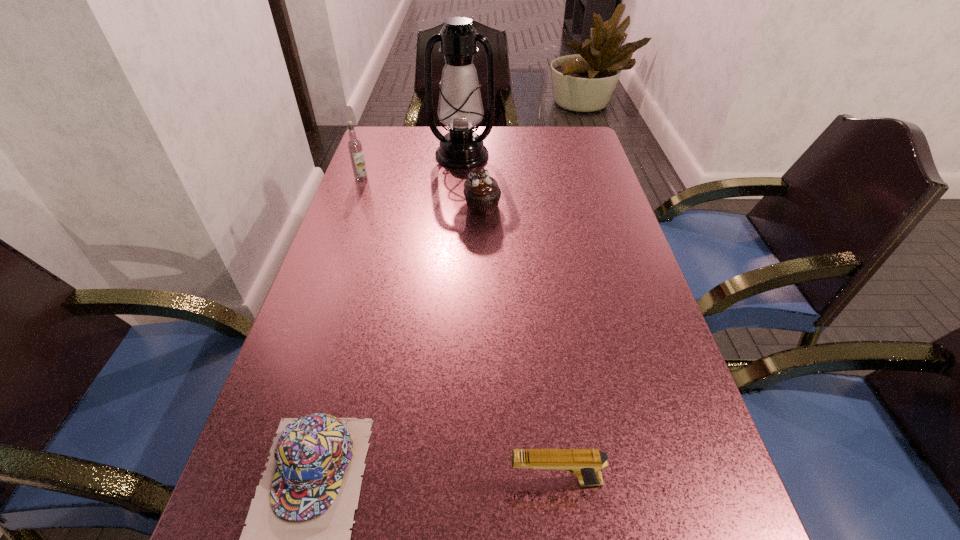
Identify the location of empty space between the fourth shortest object and the pistol. The image size is (960, 540). (458, 330).

Locate an element on the screen. The width and height of the screenshot is (960, 540). free space that is in between the tallest object and the vodka is located at coordinates (412, 167).

This screenshot has height=540, width=960. In order to click on vacant space in between the third nearest object and the pistol in this screenshot , I will do `click(518, 344)`.

Where is `vacant area that lies between the second farthest object and the oil lamp`? The image size is (960, 540). vacant area that lies between the second farthest object and the oil lamp is located at coordinates (412, 167).

This screenshot has height=540, width=960. I want to click on free spot between the pistol and the third farthest object, so click(518, 344).

At what (x,y) coordinates should I click in order to perform the action: click on vacant point located between the pistol and the second tallest object. Please return your answer as a coordinate pair (x, y). The image size is (960, 540). Looking at the image, I should click on (458, 330).

Image resolution: width=960 pixels, height=540 pixels. I want to click on the third closest object to the third farthest object, so click(297, 536).

I want to click on object that is the fourth closest to the second farthest object, so click(586, 464).

The width and height of the screenshot is (960, 540). Find the location of `free location that satisfies the following two spatial constraints: 1. on the label of the third farthest object; 2. on the right side of the vodka`. free location that satisfies the following two spatial constraints: 1. on the label of the third farthest object; 2. on the right side of the vodka is located at coordinates (351, 207).